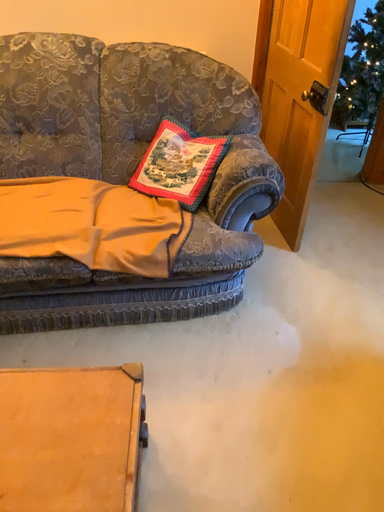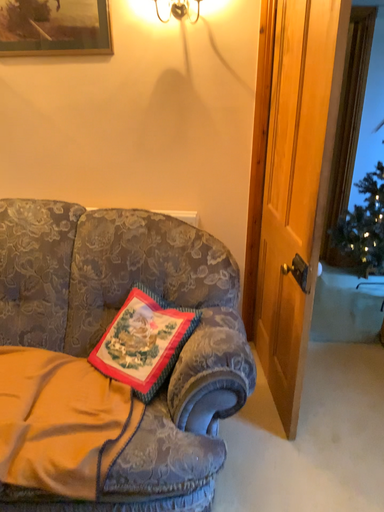
Question: How did the camera likely rotate when shooting the video?

Choices:
 (A) rotated upward
 (B) rotated downward

Answer: (A)